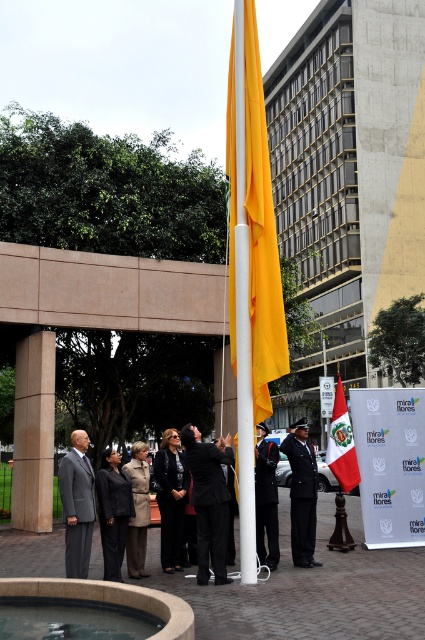
Between gray suit at center and light brown leather coat at center, which one is positioned lower?

light brown leather coat at center

Between gray suit at center and light brown leather coat at center, which one appears on the left side from the viewer's perspective?

gray suit at center

Who is more forward, (73, 568) or (141, 529)?

Point (73, 568) is in front.

At what (x,y) coordinates should I click in order to perform the action: click on gray suit at center. Please return your answer as a coordinate pair (x, y). Image resolution: width=425 pixels, height=640 pixels. Looking at the image, I should click on (76, 504).

Is yellow fabric flag at center shorter than smooth stone fountain at lower left?

In fact, yellow fabric flag at center may be taller than smooth stone fountain at lower left.

Is yellow fabric flag at center behind smooth stone fountain at lower left?

Yes, yellow fabric flag at center is behind smooth stone fountain at lower left.

What are the coordinates of `yellow fabric flag at center` in the screenshot? It's located at (252, 218).

Who is positioned more to the left, light brown leather coat at center or peruvian flag at center?

light brown leather coat at center is more to the left.

Who is shorter, light brown leather coat at center or peruvian flag at center?

light brown leather coat at center

Who is more forward, (135,516) or (351,452)?

Point (135,516) is in front.

This screenshot has height=640, width=425. I want to click on light brown leather coat at center, so (x=138, y=509).